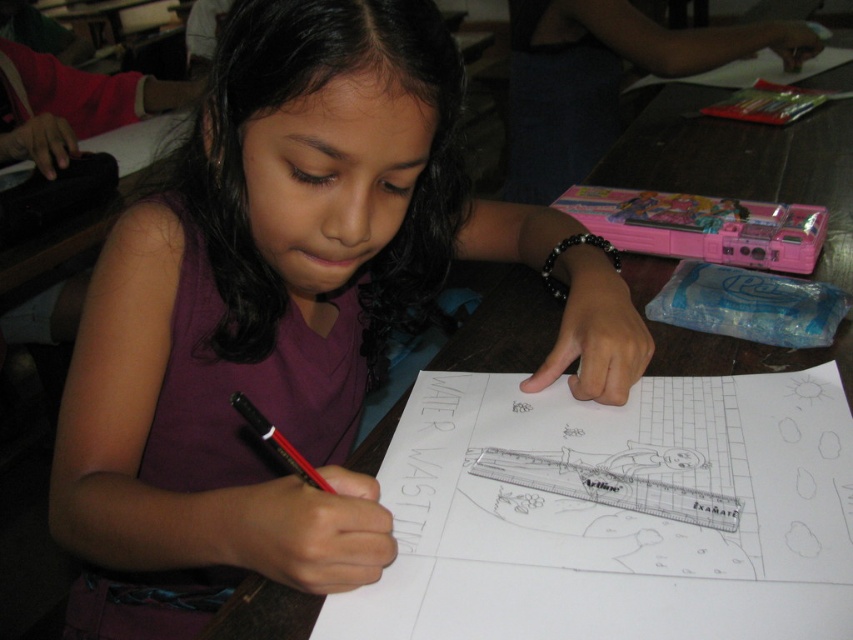
You are a photographer setting up for a portrait. You need to position a light source so that it illuminates both the matte purple shirt at center and the matte black pen at lower center. Based on their positions, which side of the pen should the light be placed to ensure both are well lit without casting shadows over the shirt?

The light should be placed to the right side of the matte black pen at lower center. Since the matte purple shirt at center is to the left of the pen, placing the light to the right ensures both receive even illumination and avoids the pen casting a shadow over the shirt.

What are the coordinates of the matte purple shirt at center in the image?

The coordinates of the matte purple shirt at center are at point (287, 314).